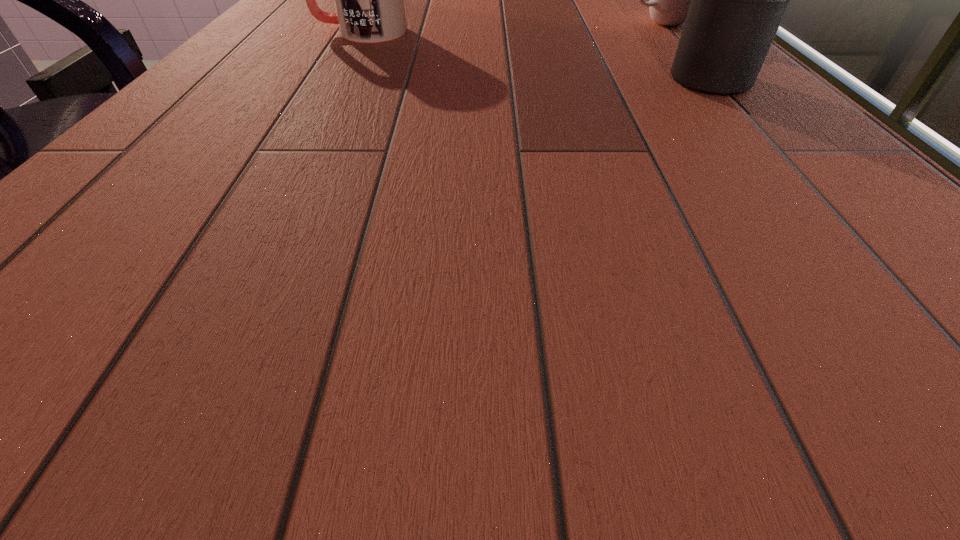
The height and width of the screenshot is (540, 960). In order to click on free area in between the leftmost object and the shortest object in this screenshot , I will do `click(510, 28)`.

The width and height of the screenshot is (960, 540). In order to click on object that is the closest one to the nearest object in this screenshot , I will do `click(669, 3)`.

Find the location of a particular element. This screenshot has height=540, width=960. object that ranks as the closest to the tallest object is located at coordinates (669, 3).

The width and height of the screenshot is (960, 540). Find the location of `vacant space that satisfies the following two spatial constraints: 1. on the front side of the nearest object; 2. on the surface of the cup near the warning symbol`. vacant space that satisfies the following two spatial constraints: 1. on the front side of the nearest object; 2. on the surface of the cup near the warning symbol is located at coordinates (709, 81).